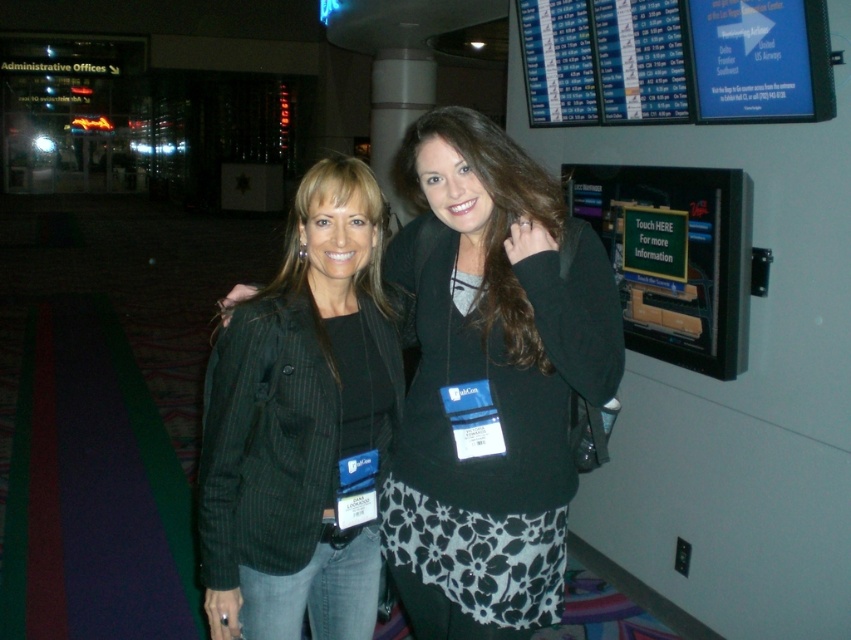
Question: Where is black pinstripe blazer at center located in relation to green pinstripe blazer at center in the image?

Choices:
 (A) right
 (B) left

Answer: (A)

Question: Is black pinstripe blazer at center above green pinstripe blazer at center?

Choices:
 (A) no
 (B) yes

Answer: (B)

Question: Which object is closer to the camera taking this photo?

Choices:
 (A) black pinstripe blazer at center
 (B) green pinstripe blazer at center

Answer: (A)

Question: Among these points, which one is farthest from the camera?

Choices:
 (A) (453, 435)
 (B) (343, 188)

Answer: (A)

Question: Is black pinstripe blazer at center positioned before green pinstripe blazer at center?

Choices:
 (A) yes
 (B) no

Answer: (A)

Question: Which of the following is the farthest from the observer?

Choices:
 (A) (450, 136)
 (B) (346, 257)

Answer: (B)